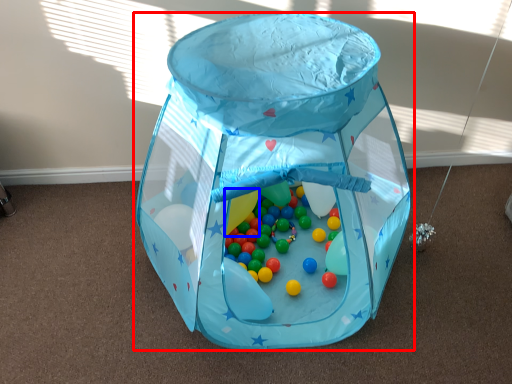
Question: Which object appears farthest to the camera in this image, toy (highlighted by a red box) or balloon (highlighted by a blue box)?

Choices:
 (A) toy
 (B) balloon

Answer: (B)